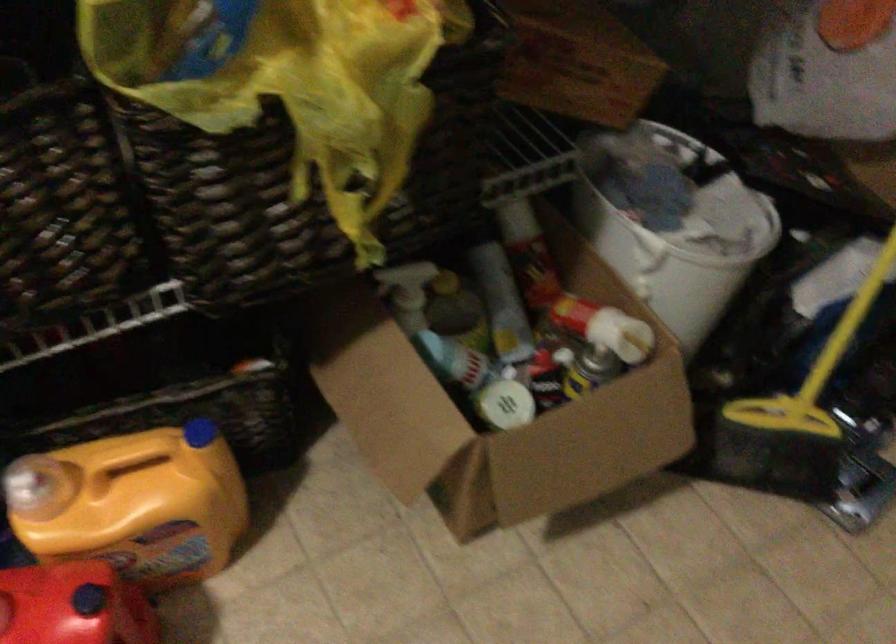
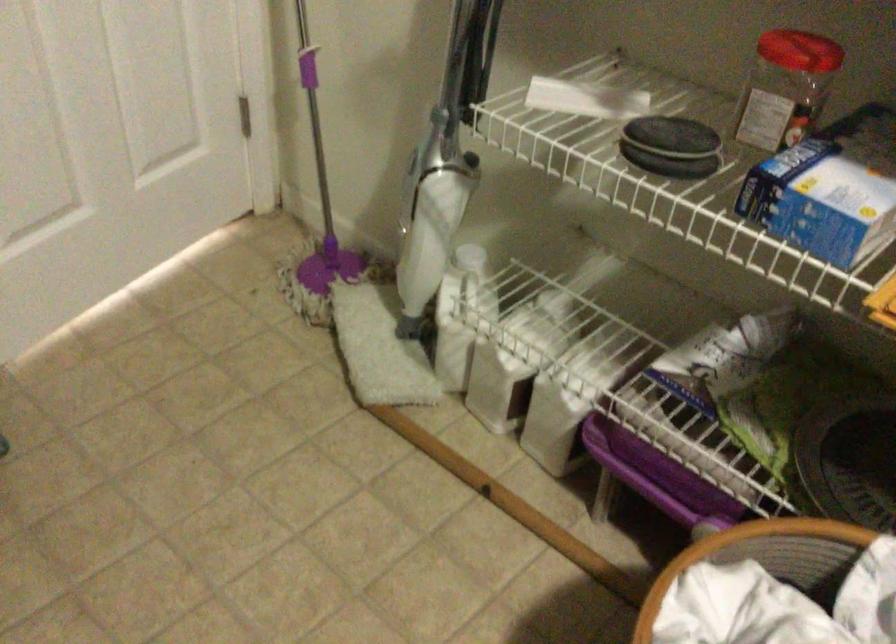
The first image is from the beginning of the video and the second image is from the end. How did the camera likely rotate when shooting the video?

The rotation direction of the camera is right-down.